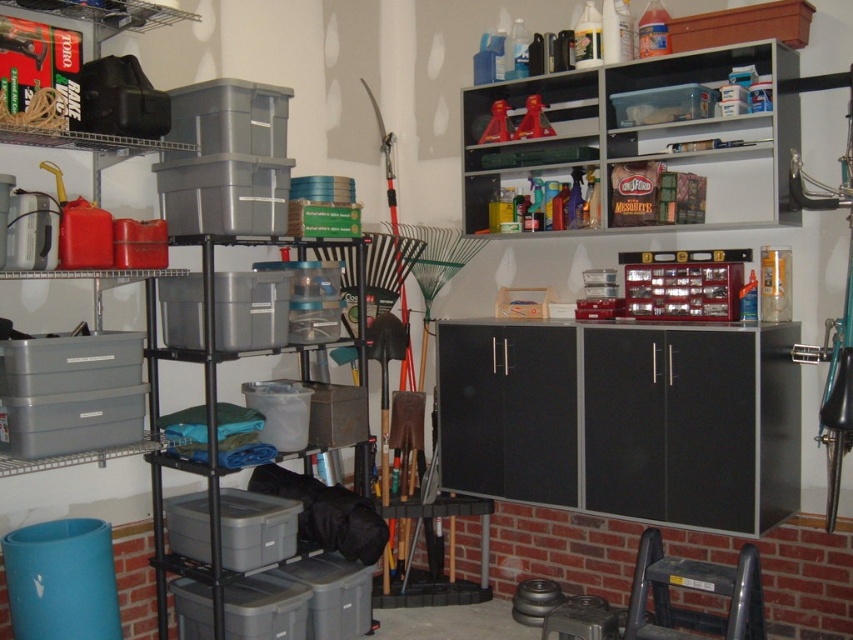
You are organizing items in the garage and need to place a tall item. Which object between the matte plastic shelf at upper center and the gray plastic bins at left is more suitable for placing a tall item?

The matte plastic shelf at upper center is much taller than the gray plastic bins at left, making it more suitable for placing a tall item.

You need to store a large item that requires a sturdy surface. Which object between the matte plastic shelf at upper center and the gray plastic bins at left would be more suitable based on their size?

The matte plastic shelf at upper center has a larger size compared to the gray plastic bins at left, making it more suitable for storing a large item that requires a sturdy surface.